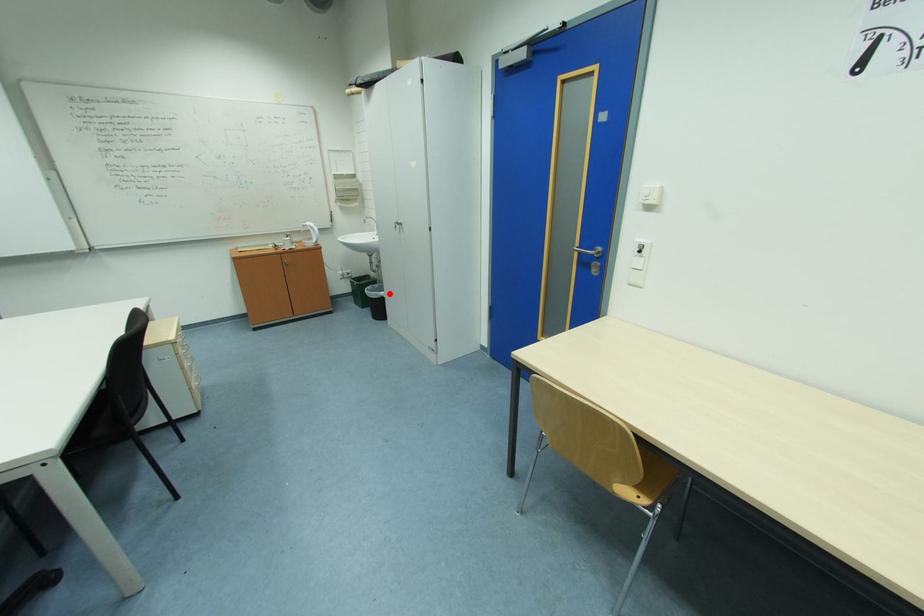
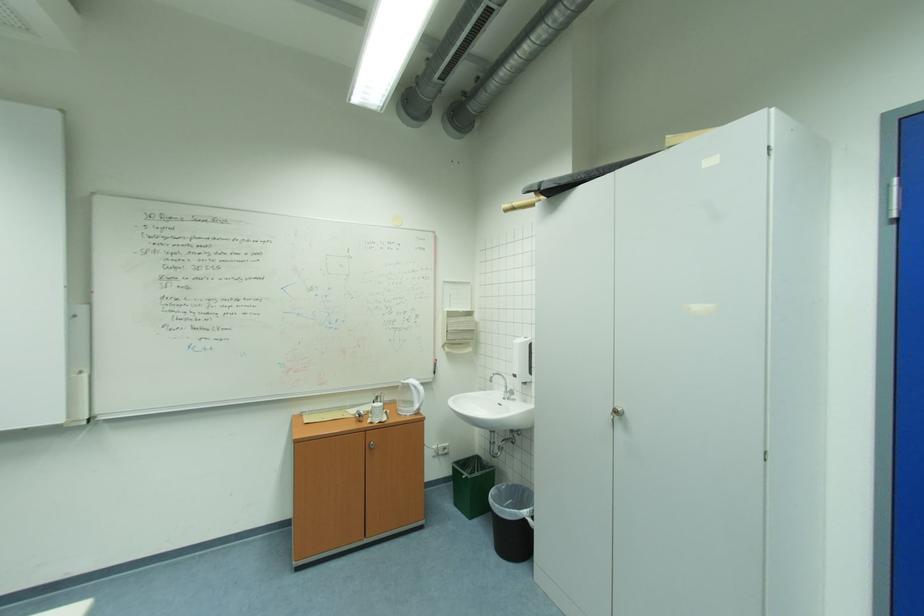
Where in the second image is the point corresponding to the highlighted location from the first image?

(532, 513)